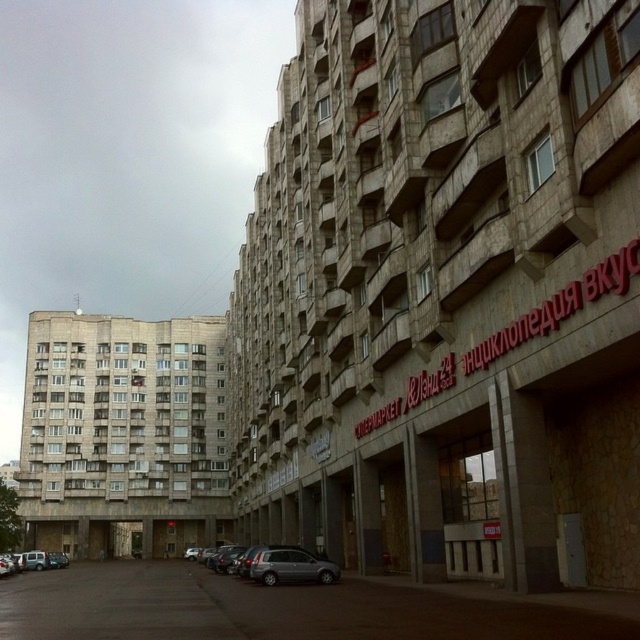
Does silver metallic car at lower center have a greater height compared to silver metallic car at lower left?

No, silver metallic car at lower center is not taller than silver metallic car at lower left.

Is point (212, 570) farther from viewer compared to point (42, 560)?

That is False.

Find the location of a particular element. The height and width of the screenshot is (640, 640). silver metallic car at lower center is located at coordinates (285, 564).